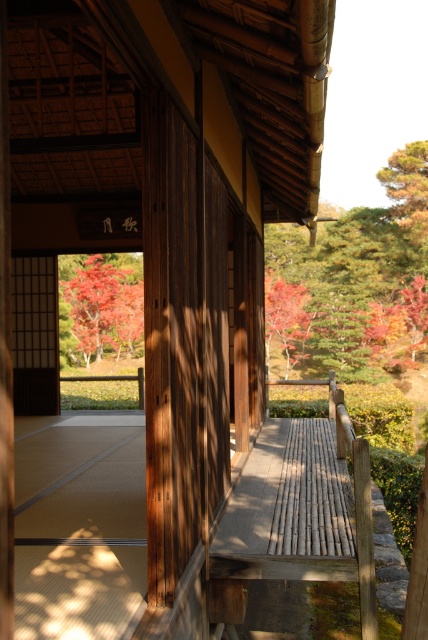
In the scene shown: Which is more to the right, autumn leaves at upper right or bamboo rail at center?

From the viewer's perspective, autumn leaves at upper right appears more on the right side.

Does point (341, 260) come in front of point (228, 618)?

No, it is not.

The width and height of the screenshot is (428, 640). In order to click on autumn leaves at upper right in this screenshot , I will do `click(357, 280)`.

Identify the location of autumn leaves at upper right. (357, 280).

Is autumn leaves at upper right thinner than vivid red leaves at center?

No, autumn leaves at upper right is not thinner than vivid red leaves at center.

What do you see at coordinates (357, 280) in the screenshot?
I see `autumn leaves at upper right` at bounding box center [357, 280].

Where is `autumn leaves at upper right`? The image size is (428, 640). autumn leaves at upper right is located at coordinates (357, 280).

Identify the location of bamboo rail at center. The height and width of the screenshot is (640, 428). (297, 513).

Which of these two, bamboo rail at center or vivid red leaves at center, stands taller?

vivid red leaves at center

Is point (363, 620) closer to camera compared to point (112, 262)?

That is True.

Locate an element on the screen. The width and height of the screenshot is (428, 640). bamboo rail at center is located at coordinates (297, 513).